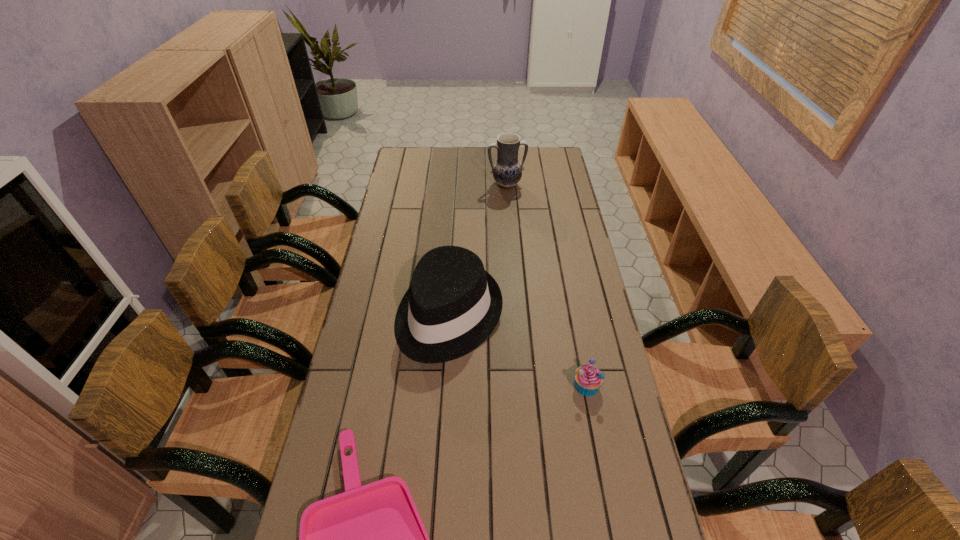
Where is `blank area in the image that satisfies the following two spatial constraints: 1. on the front side of the second farthest object; 2. on the left side of the second shortest object`? blank area in the image that satisfies the following two spatial constraints: 1. on the front side of the second farthest object; 2. on the left side of the second shortest object is located at coordinates (444, 385).